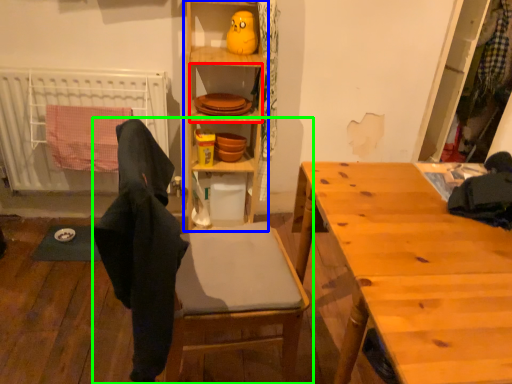
Question: Which is nearer to the shelf (highlighted by a red box)? cabinetry (highlighted by a blue box) or chair (highlighted by a green box).

Choices:
 (A) cabinetry
 (B) chair

Answer: (A)